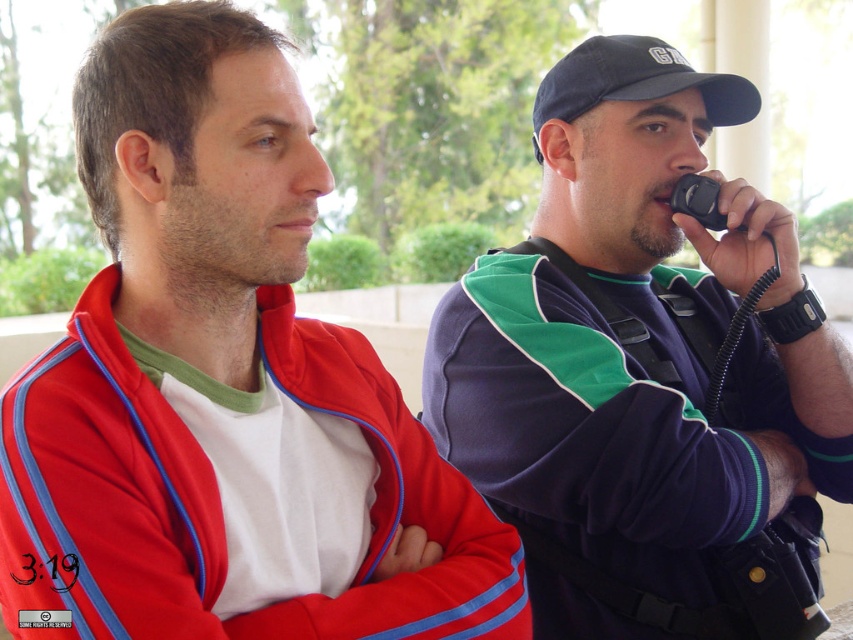
Question: Which point is closer to the camera?

Choices:
 (A) (767, 262)
 (B) (434, 467)

Answer: (B)

Question: Considering the relative positions of navy blue/green fabric jacket at right and black plastic phone at right in the image provided, where is navy blue/green fabric jacket at right located with respect to black plastic phone at right?

Choices:
 (A) below
 (B) above

Answer: (A)

Question: Can you confirm if navy blue/green fabric jacket at right is thinner than black rubber walkie-talkie at right?

Choices:
 (A) no
 (B) yes

Answer: (A)

Question: Which of the following is the closest to the observer?

Choices:
 (A) black fabric baseball cap at upper right
 (B) navy blue/green fabric jacket at right
 (C) black rubber walkie-talkie at right
 (D) matte red jacket at center

Answer: (D)

Question: Is matte red jacket at center in front of black fabric baseball cap at upper right?

Choices:
 (A) no
 (B) yes

Answer: (B)

Question: Which point is farther from the camera taking this photo?

Choices:
 (A) (677, 208)
 (B) (686, 560)

Answer: (A)